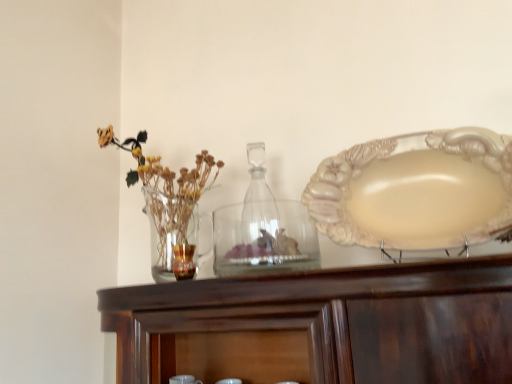
I want to click on translucent glass vase at left, so coord(169,202).

What is the approximate height of translucent glass vase at left?

It is 43.76 centimeters.

Locate an element on the screen. Image resolution: width=512 pixels, height=384 pixels. translucent glass candle at center, which is the 2th tableware from right to left is located at coordinates (183, 261).

Which point is more forward, [247,231] or [164,193]?

The point [164,193] is more forward.

Can you tell me how much transparent glass bottle at center and translucent glass vase at left differ in facing direction?

They differ by 0.57 degrees in their facing directions.

Identify the location of floral arrangement above the transparent glass bottle at center (from a real-world perspective). (169, 202).

Can you confirm if transparent glass bottle at center is smaller than translucent glass vase at left?

Yes.

Is clear glass jar at center, the 2th tableware viewed from the left, facing away from translucent glass vase at left?

clear glass jar at center, the 2th tableware viewed from the left, does not have its back to translucent glass vase at left.

From the image's perspective, which one is positioned higher, clear glass jar at center, placed as the first tableware when sorted from right to left, or translucent glass vase at left?

From the image's view, translucent glass vase at left is above.

Which is more to the right, clear glass jar at center, the 2th tableware viewed from the left, or translucent glass vase at left?

clear glass jar at center, the 2th tableware viewed from the left.

From the image's perspective, would you say translucent glass candle at center, which is the 2th tableware from right to left, is positioned over transparent glass bottle at center?

Incorrect, from the image's perspective, translucent glass candle at center, which is the 2th tableware from right to left, is lower than transparent glass bottle at center.

Could you tell me if translucent glass candle at center, which is the 2th tableware from right to left, is facing transparent glass bottle at center?

No, translucent glass candle at center, which is the 2th tableware from right to left, is not aimed at transparent glass bottle at center.

Which is behind, point (175, 246) or point (255, 241)?

Positioned behind is point (175, 246).

Measure the distance from translucent glass candle at center, which is counted as the first tableware, starting from the left, to transparent glass bottle at center.

translucent glass candle at center, which is counted as the first tableware, starting from the left, is 9.76 inches away from transparent glass bottle at center.

Based on the photo, based on their positions, is matte cream plate at right located to the left or right of transparent glass bottle at center?

Based on their positions, matte cream plate at right is located to the right of transparent glass bottle at center.

What's the angular difference between matte cream plate at right and transparent glass bottle at center's facing directions?

There is a 3.7-degree angle between the facing directions of matte cream plate at right and transparent glass bottle at center.

Which object is wider, matte cream plate at right or transparent glass bottle at center?

With larger width is matte cream plate at right.

The height and width of the screenshot is (384, 512). Identify the location of plate above the transparent glass bottle at center (from the image's perspective). (414, 188).

Are transparent glass bottle at center and clear glass jar at center, placed as the first tableware when sorted from right to left, located far from each other?

Actually, transparent glass bottle at center and clear glass jar at center, placed as the first tableware when sorted from right to left, are a little close together.

Considering the relative positions of transparent glass bottle at center and clear glass jar at center, the 2th tableware viewed from the left, in the image provided, is transparent glass bottle at center to the right of clear glass jar at center, the 2th tableware viewed from the left, from the viewer's perspective?

Correct, you'll find transparent glass bottle at center to the right of clear glass jar at center, the 2th tableware viewed from the left.

Between point (276, 226) and point (256, 248), which one is positioned in front?

The point (276, 226) is more forward.

Is clear glass jar at center, the 2th tableware viewed from the left, at the back of transparent glass bottle at center?

No, transparent glass bottle at center is not facing the opposite direction of clear glass jar at center, the 2th tableware viewed from the left.

Is point (223, 275) more distant than point (371, 163)?

Yes, point (223, 275) is behind point (371, 163).

Consider the image. From the image's perspective, does clear glass jar at center, the 2th tableware viewed from the left, appear lower than matte cream plate at right?

Indeed, from the image's perspective, clear glass jar at center, the 2th tableware viewed from the left, is shown beneath matte cream plate at right.

Is clear glass jar at center, placed as the first tableware when sorted from right to left, oriented towards matte cream plate at right?

No, clear glass jar at center, placed as the first tableware when sorted from right to left, is not oriented towards matte cream plate at right.

From a real-world perspective, which object rests below the other?

From a 3D spatial view, clear glass jar at center, placed as the first tableware when sorted from right to left, is below.

Which of these two, clear glass jar at center, the 2th tableware viewed from the left, or translucent glass candle at center, which is counted as the first tableware, starting from the left, is smaller?

With smaller size is translucent glass candle at center, which is counted as the first tableware, starting from the left.

From a real-world perspective, is clear glass jar at center, the 2th tableware viewed from the left, positioned under translucent glass candle at center, which is counted as the first tableware, starting from the left, based on gravity?

No, from a real-world perspective, clear glass jar at center, the 2th tableware viewed from the left, is not below translucent glass candle at center, which is counted as the first tableware, starting from the left.

Is clear glass jar at center, placed as the first tableware when sorted from right to left, closer to the viewer compared to translucent glass candle at center, which is the 2th tableware from right to left?

Yes, it is in front of translucent glass candle at center, which is the 2th tableware from right to left.

Where is `tableware located on the right of translucent glass candle at center, which is counted as the first tableware, starting from the left`? tableware located on the right of translucent glass candle at center, which is counted as the first tableware, starting from the left is located at coordinates (264, 242).

Locate an element on the screen. The height and width of the screenshot is (384, 512). bottle below the translucent glass vase at left (from a real-world perspective) is located at coordinates (259, 207).

Locate an element on the screen. The image size is (512, 384). tableware that is the 2nd one when counting forward from the translucent glass vase at left is located at coordinates (264, 242).

Based on their spatial positions, is clear glass jar at center, placed as the first tableware when sorted from right to left, or translucent glass vase at left further from transparent glass bottle at center?

translucent glass vase at left is positioned further to the anchor transparent glass bottle at center.

Based on their spatial positions, is matte cream plate at right or translucent glass candle at center, which is counted as the first tableware, starting from the left, closer to transparent glass bottle at center?

translucent glass candle at center, which is counted as the first tableware, starting from the left, lies closer to transparent glass bottle at center than the other object.

Based on their spatial positions, is translucent glass vase at left or clear glass jar at center, the 2th tableware viewed from the left, closer to transparent glass bottle at center?

clear glass jar at center, the 2th tableware viewed from the left, is closer to transparent glass bottle at center.

Which object lies further to the anchor point translucent glass vase at left, translucent glass candle at center, which is counted as the first tableware, starting from the left, or transparent glass bottle at center?

transparent glass bottle at center is positioned further to the anchor translucent glass vase at left.

Estimate the real-world distances between objects in this image. Which object is closer to clear glass jar at center, placed as the first tableware when sorted from right to left, matte cream plate at right or translucent glass vase at left?

Among the two, translucent glass vase at left is located nearer to clear glass jar at center, placed as the first tableware when sorted from right to left.

From the image, which object appears to be nearer to matte cream plate at right, transparent glass bottle at center or clear glass jar at center, the 2th tableware viewed from the left?

clear glass jar at center, the 2th tableware viewed from the left, is closer to matte cream plate at right.

When comparing their distances from matte cream plate at right, does transparent glass bottle at center or translucent glass candle at center, which is the 2th tableware from right to left, seem closer?

transparent glass bottle at center is positioned closer to the anchor matte cream plate at right.

From the image, which object appears to be farther from translucent glass vase at left, matte cream plate at right or clear glass jar at center, placed as the first tableware when sorted from right to left?

matte cream plate at right lies further to translucent glass vase at left than the other object.

Identify the location of bottle between translucent glass vase at left and matte cream plate at right. This screenshot has height=384, width=512. click(259, 207).

Identify the location of bottle between translucent glass candle at center, which is the 2th tableware from right to left, and matte cream plate at right, in the horizontal direction. (259, 207).

Identify the location of tableware between translucent glass vase at left and clear glass jar at center, the 2th tableware viewed from the left. The height and width of the screenshot is (384, 512). (183, 261).

Where is `tableware between translucent glass candle at center, which is the 2th tableware from right to left, and matte cream plate at right`? The width and height of the screenshot is (512, 384). tableware between translucent glass candle at center, which is the 2th tableware from right to left, and matte cream plate at right is located at coordinates (264, 242).